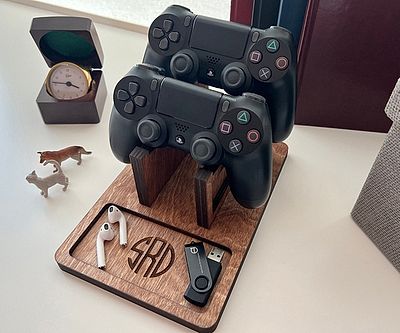
Identify the location of black usb stick. Image resolution: width=400 pixels, height=333 pixels. (208, 277).